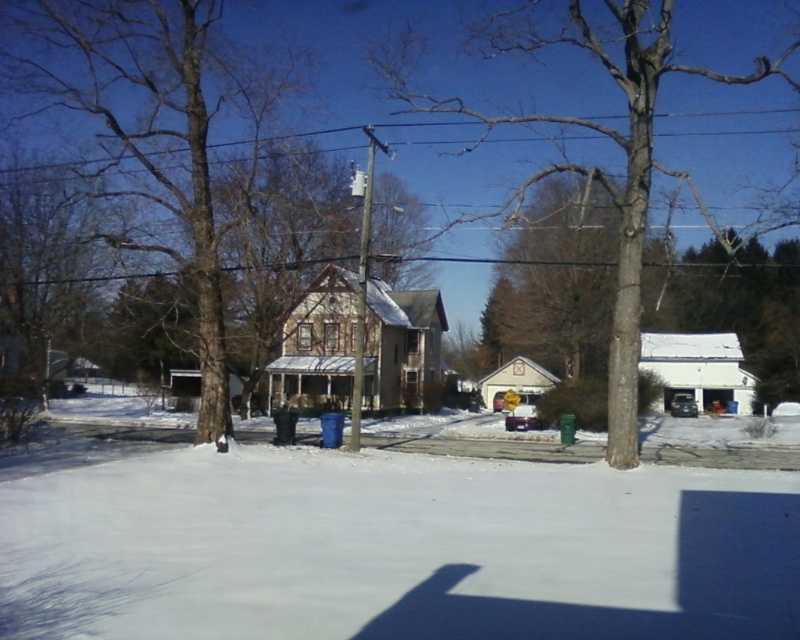
From the picture: You are standing in the winter scene and want to reach the point marked at coordinates (529, 182). Given that you can walk 100 feet before needing a rest, will you be able to reach that point without resting?

The point at (529, 182) is 77.93 feet away from the viewer. Since you can walk 100 feet before needing a rest, you can reach the point without resting.

You are standing in the middle of the snow and looking at the brown textured tree at center and the white plastic utility pole at center. Which object is higher up in the image?

The brown textured tree at center is located above the white plastic utility pole at center, so the brown textured tree at center is higher up in the image.